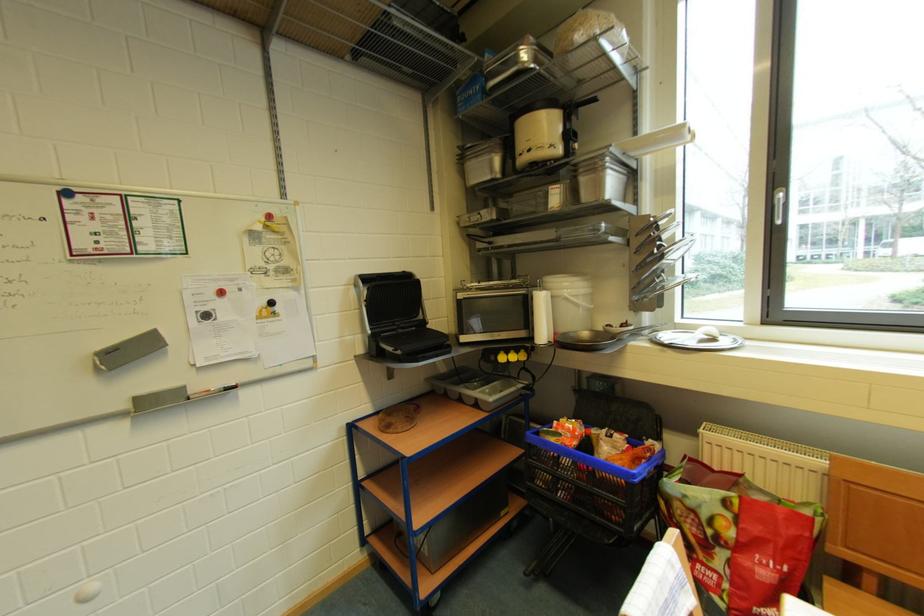
Image resolution: width=924 pixels, height=616 pixels. What do you see at coordinates (598, 337) in the screenshot?
I see `a frying pan handle` at bounding box center [598, 337].